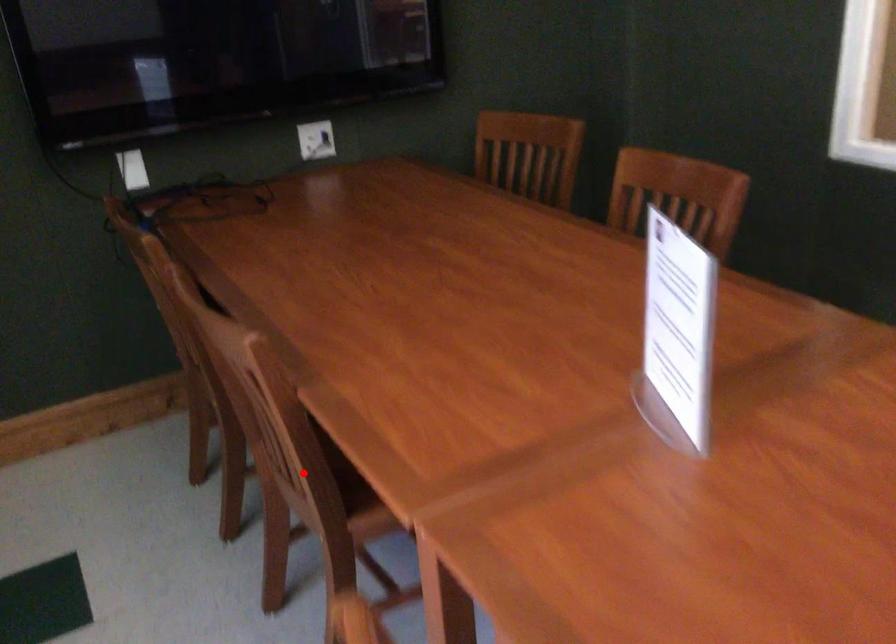
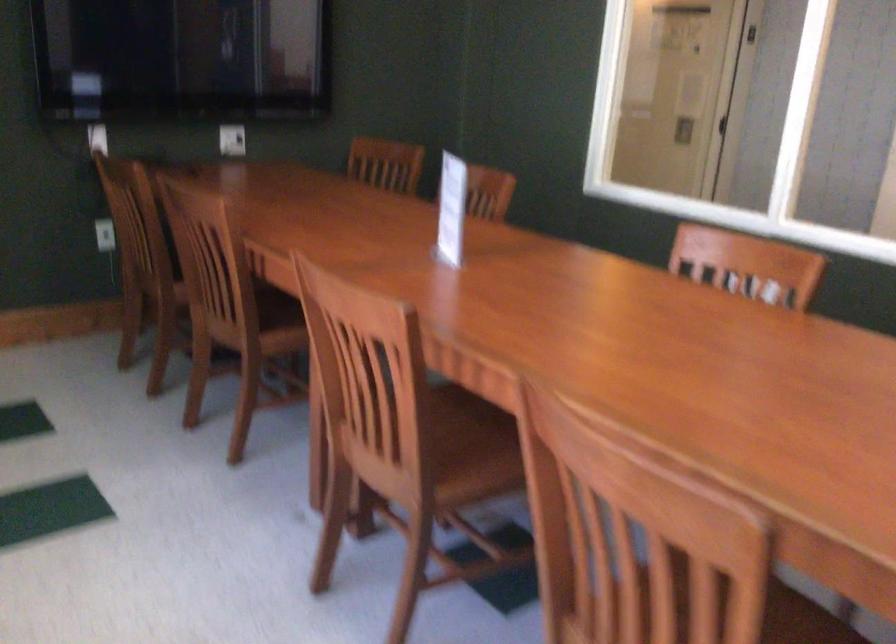
Find the pixel in the second image that matches the highlighted location in the first image.

(239, 303)